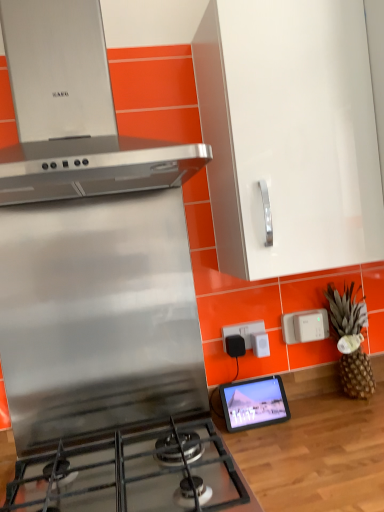
Question: From the image's perspective, is black plastic outlet at center, the first electric outlet in the left-to-right sequence, on white plastic power strip at center?

Choices:
 (A) yes
 (B) no

Answer: (A)

Question: Is black plastic outlet at center, the first electric outlet in the left-to-right sequence, far from white plastic power strip at center?

Choices:
 (A) yes
 (B) no

Answer: (B)

Question: Is black plastic outlet at center, the first electric outlet in the left-to-right sequence, oriented away from white plastic power strip at center?

Choices:
 (A) no
 (B) yes

Answer: (B)

Question: Considering the relative positions of black plastic outlet at center, which is the 2th electric outlet in right-to-left order, and white plastic power strip at center in the image provided, is black plastic outlet at center, which is the 2th electric outlet in right-to-left order, to the left of white plastic power strip at center from the viewer's perspective?

Choices:
 (A) no
 (B) yes

Answer: (B)

Question: Can you confirm if black plastic outlet at center, the first electric outlet in the left-to-right sequence, is thinner than white plastic power strip at center?

Choices:
 (A) no
 (B) yes

Answer: (B)

Question: Considering the positions of white plastic power strip at center and brown textured pineapple at right in the image, is white plastic power strip at center taller or shorter than brown textured pineapple at right?

Choices:
 (A) tall
 (B) short

Answer: (B)

Question: Would you say white plastic power strip at center is inside or outside brown textured pineapple at right?

Choices:
 (A) inside
 (B) outside

Answer: (B)

Question: From the image's perspective, is white plastic power strip at center located above or below brown textured pineapple at right?

Choices:
 (A) below
 (B) above

Answer: (A)

Question: From a real-world perspective, relative to brown textured pineapple at right, is white plastic power strip at center vertically above or below?

Choices:
 (A) below
 (B) above

Answer: (B)

Question: In terms of width, does brown textured pineapple at right look wider or thinner when compared to white plastic electric outlet at right, marked as the second electric outlet in a left-to-right arrangement?

Choices:
 (A) wide
 (B) thin

Answer: (A)

Question: Would you say brown textured pineapple at right is to the left or to the right of white plastic electric outlet at right, marked as the second electric outlet in a left-to-right arrangement, in the picture?

Choices:
 (A) left
 (B) right

Answer: (B)

Question: Looking at the image, does brown textured pineapple at right seem bigger or smaller compared to white plastic electric outlet at right, marked as the second electric outlet in a left-to-right arrangement?

Choices:
 (A) small
 (B) big

Answer: (B)

Question: From the image's perspective, is brown textured pineapple at right above or below white plastic electric outlet at right, which is the 1th electric outlet in right-to-left order?

Choices:
 (A) above
 (B) below

Answer: (B)

Question: From the image's perspective, is stainless steel stove at center located above or below white glossy cabinet at upper center?

Choices:
 (A) below
 (B) above

Answer: (A)

Question: Is stainless steel stove at center bigger or smaller than white glossy cabinet at upper center?

Choices:
 (A) small
 (B) big

Answer: (A)